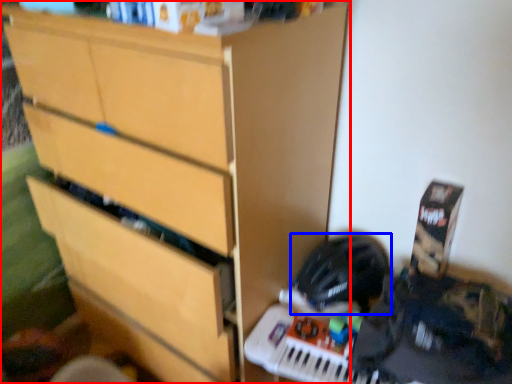
Question: Which point is closer to the camera, chest of drawers (highlighted by a red box) or helmet (highlighted by a blue box)?

Choices:
 (A) chest of drawers
 (B) helmet

Answer: (A)